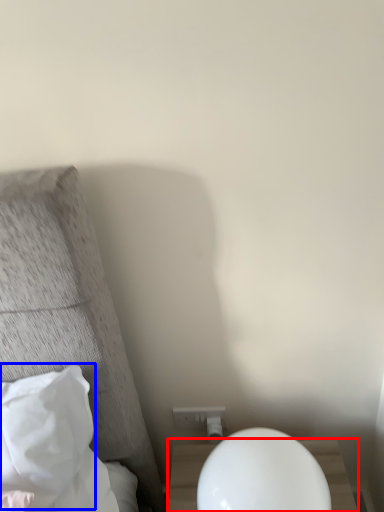
Question: Which object is further to the camera taking this photo, nightstand (highlighted by a red box) or pillow (highlighted by a blue box)?

Choices:
 (A) nightstand
 (B) pillow

Answer: (B)